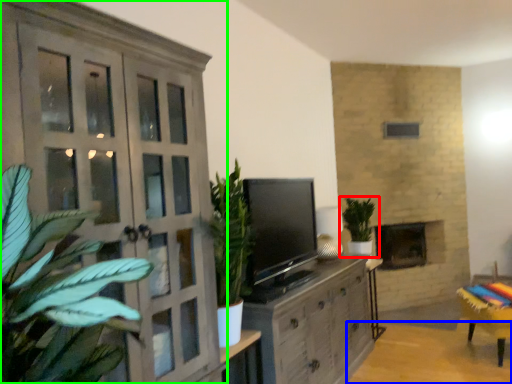
Question: Considering the real-world distances, which object is closest to houseplant (highlighted by a red box)? table (highlighted by a blue box) or cupboard (highlighted by a green box).

Choices:
 (A) table
 (B) cupboard

Answer: (A)